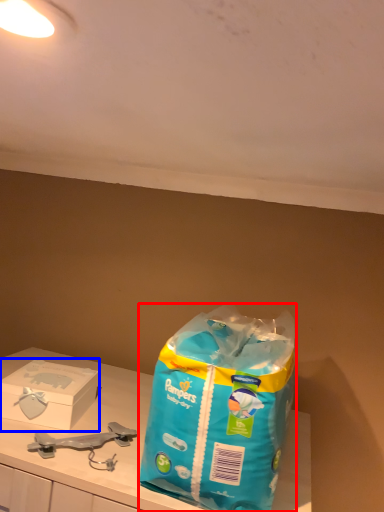
Question: Among these objects, which one is farthest to the camera, shopping bag (highlighted by a red box) or box (highlighted by a blue box)?

Choices:
 (A) shopping bag
 (B) box

Answer: (B)